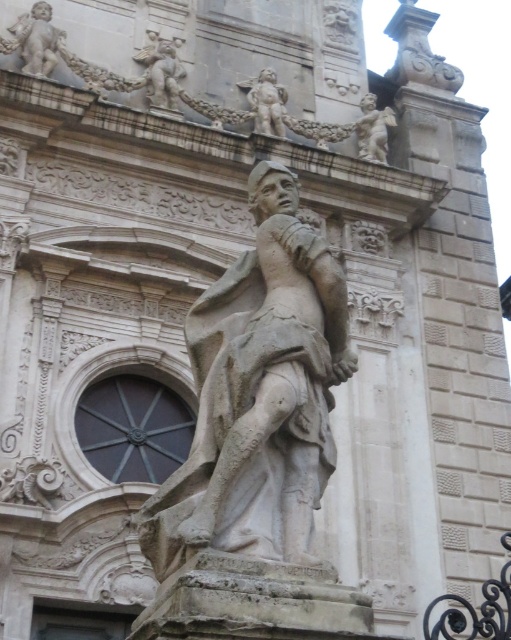
Question: Which of the following is the closest to the observer?

Choices:
 (A) stone statue at upper center
 (B) stone statue at center
 (C) smooth stone cherub at upper left
 (D) polished stone cherub at upper right

Answer: (B)

Question: Can you confirm if stone statue at center is positioned above smooth stone cherub at upper left?

Choices:
 (A) no
 (B) yes

Answer: (A)

Question: Can you confirm if smooth stone cherub at upper left is thinner than polished stone cherub at upper right?

Choices:
 (A) yes
 (B) no

Answer: (B)

Question: Can you confirm if stone statue at center is positioned below polished stone cherub at upper right?

Choices:
 (A) no
 (B) yes

Answer: (B)

Question: Estimate the real-world distances between objects in this image. Which object is farther from the smooth stone cherub at upper left?

Choices:
 (A) stone statue at upper center
 (B) stone statue at center
 (C) polished stone cherub at upper right

Answer: (B)

Question: Which of the following is the closest to the observer?

Choices:
 (A) (285, 93)
 (B) (378, 141)

Answer: (A)